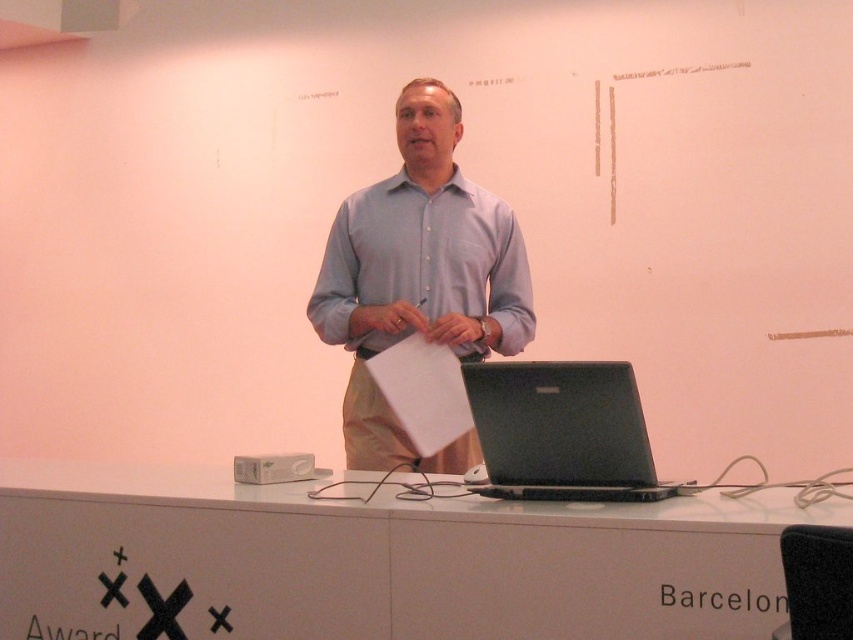
You are organizing a presentation and need to place a 12x12 inch square poster on the white glossy table at center. Given that the black matte laptop at center is already placed on the table, can the poster fit on the table without overlapping the laptop?

The white glossy table at center is larger in size than the black matte laptop at center, so the poster can be placed on the table without overlapping the laptop as there is enough space available.